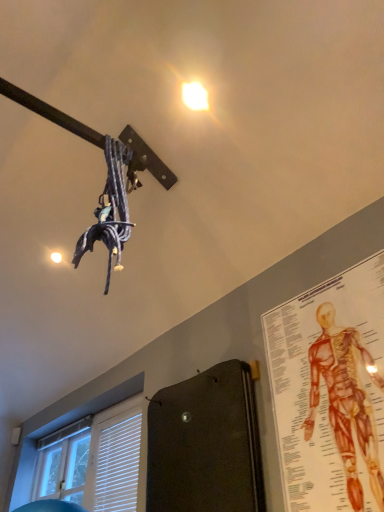
I want to click on anatomical chart at upper right, so click(x=345, y=402).

This screenshot has width=384, height=512. What do you see at coordinates (118, 466) in the screenshot?
I see `white plastic blinds at lower left` at bounding box center [118, 466].

Identify the location of anatomical chart at upper right. This screenshot has height=512, width=384. (345, 402).

In the scene shown: Is white glossy droplight at upper center not near anatomical chart at upper right?

Absolutely, white glossy droplight at upper center is distant from anatomical chart at upper right.

Does white glossy droplight at upper center turn towards anatomical chart at upper right?

No.

Considering the sizes of objects white glossy droplight at upper center and anatomical chart at upper right in the image provided, who is taller, white glossy droplight at upper center or anatomical chart at upper right?

anatomical chart at upper right is taller.

From the image's perspective, which is below, white glossy droplight at upper center or anatomical chart at upper right?

From the image's view, anatomical chart at upper right is below.

Considering the sizes of objects white glossy droplight at upper center and white plastic blinds at lower left in the image provided, who is thinner, white glossy droplight at upper center or white plastic blinds at lower left?

Thinner between the two is white plastic blinds at lower left.

Would you say white glossy droplight at upper center is outside white plastic blinds at lower left?

white glossy droplight at upper center lies outside white plastic blinds at lower left's area.

How far apart are white glossy droplight at upper center and white plastic blinds at lower left?

white glossy droplight at upper center is 1.94 meters from white plastic blinds at lower left.

Is white glossy droplight at upper center to the left or to the right of white plastic blinds at lower left in the image?

Based on their positions, white glossy droplight at upper center is located to the right of white plastic blinds at lower left.

Based on the photo, how many degrees apart are the facing directions of white plastic blinds at lower left and white glossy droplight at upper center?

93.8 degrees.

From a real-world perspective, is white plastic blinds at lower left physically located above or below white glossy droplight at upper center?

white plastic blinds at lower left is below white glossy droplight at upper center.

Is point (129, 509) positioned behind point (194, 81)?

Yes.

Is white plastic blinds at lower left positioned with its back to white glossy droplight at upper center?

That's not correct — white plastic blinds at lower left is not looking away from white glossy droplight at upper center.

From a real-world perspective, is white plastic blinds at lower left physically below anatomical chart at upper right?

No, from a real-world perspective, white plastic blinds at lower left is not below anatomical chart at upper right.

Is point (119, 493) positioned after point (359, 340)?

That is True.

How different are the orientations of white plastic blinds at lower left and anatomical chart at upper right in degrees?

They differ by 0.427 degrees in their facing directions.

Which is more to the left, white plastic blinds at lower left or anatomical chart at upper right?

white plastic blinds at lower left is more to the left.

Considering the relative sizes of anatomical chart at upper right and white plastic blinds at lower left in the image provided, is anatomical chart at upper right wider than white plastic blinds at lower left?

No.

From the image's perspective, which one is positioned lower, anatomical chart at upper right or white plastic blinds at lower left?

white plastic blinds at lower left appears lower in the image.

From the picture: Is anatomical chart at upper right at the left side of white plastic blinds at lower left?

In fact, anatomical chart at upper right is to the right of white plastic blinds at lower left.

From a real-world perspective, which object stands above the other?

From a 3D spatial view, white plastic blinds at lower left is above.

In the scene shown: From the image's perspective, is anatomical chart at upper right located above white glossy droplight at upper center?

Incorrect, from the image's perspective, anatomical chart at upper right is lower than white glossy droplight at upper center.

At what (x,y) coordinates should I click in order to perform the action: click on droplight above the anatomical chart at upper right (from a real-world perspective). Please return your answer as a coordinate pair (x, y). Looking at the image, I should click on (194, 96).

Where is `droplight that is above the anatomical chart at upper right (from a real-world perspective)`? This screenshot has height=512, width=384. droplight that is above the anatomical chart at upper right (from a real-world perspective) is located at coordinates [x=194, y=96].

Where is `blind below the white glossy droplight at upper center (from the image's perspective)`? blind below the white glossy droplight at upper center (from the image's perspective) is located at coordinates (118, 466).

Considering their positions, is white plastic blinds at lower left positioned closer to white glossy droplight at upper center than anatomical chart at upper right?

The object closer to white glossy droplight at upper center is anatomical chart at upper right.

Considering their positions, is anatomical chart at upper right positioned further to white plastic blinds at lower left than white glossy droplight at upper center?

Among the two, white glossy droplight at upper center is located further to white plastic blinds at lower left.

From the image, which object appears to be farther from anatomical chart at upper right, white glossy droplight at upper center or white plastic blinds at lower left?

white plastic blinds at lower left.

Based on their spatial positions, is anatomical chart at upper right or white plastic blinds at lower left closer to white glossy droplight at upper center?

anatomical chart at upper right is positioned closer to the anchor white glossy droplight at upper center.

Based on their spatial positions, is white plastic blinds at lower left or white glossy droplight at upper center further from anatomical chart at upper right?

white plastic blinds at lower left.

Based on their spatial positions, is white glossy droplight at upper center or anatomical chart at upper right closer to white plastic blinds at lower left?

anatomical chart at upper right is positioned closer to the anchor white plastic blinds at lower left.

This screenshot has height=512, width=384. What are the coordinates of `person between white glossy droplight at upper center and white plastic blinds at lower left in the up-down direction` in the screenshot? It's located at (345, 402).